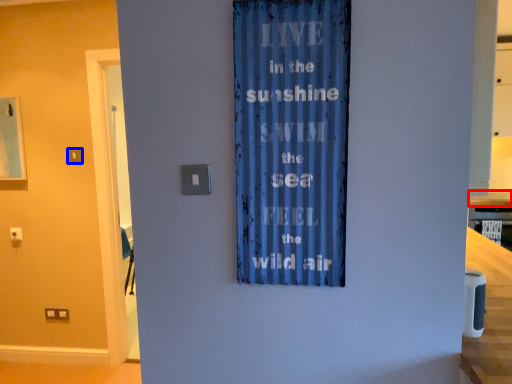
Question: Which object is closer to the camera taking this photo, counter top (highlighted by a red box) or light switch (highlighted by a blue box)?

Choices:
 (A) counter top
 (B) light switch

Answer: (B)